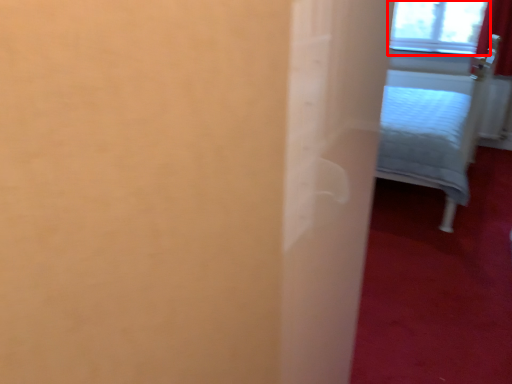
Question: From the image's perspective, considering the relative positions of window (annotated by the red box) and furniture in the image provided, where is window (annotated by the red box) located with respect to the staircase?

Choices:
 (A) above
 (B) below

Answer: (A)